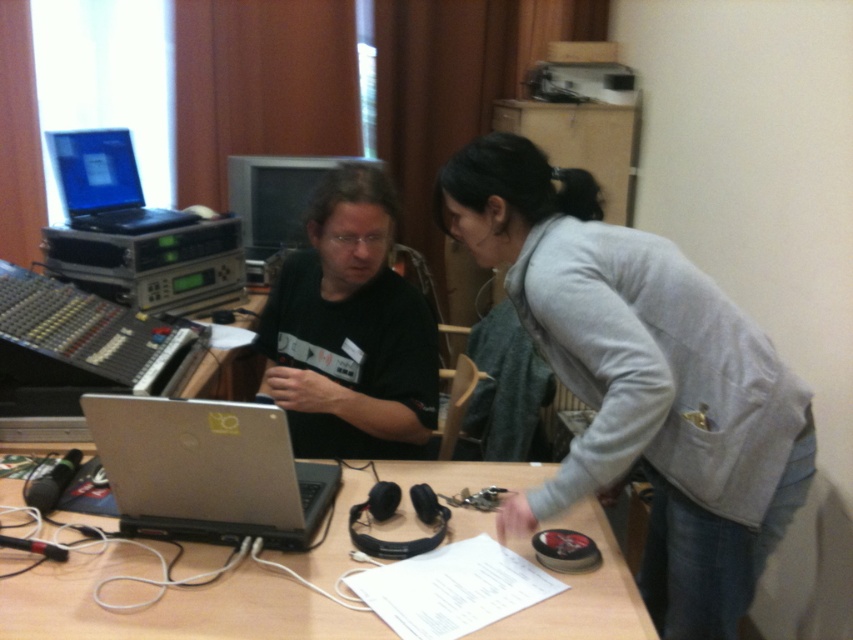
Question: Which is farther from the black matte shirt at center?

Choices:
 (A) matte black laptop at upper left
 (B) gray fabric jacket at center

Answer: (A)

Question: Is wooden table at center bigger than matte black laptop at upper left?

Choices:
 (A) no
 (B) yes

Answer: (B)

Question: Which object is the closest to the silver metallic laptop at center?

Choices:
 (A) black matte shirt at center
 (B) wooden table at center
 (C) gray fabric jacket at center

Answer: (B)

Question: In this image, where is gray fabric jacket at center located relative to wooden table at center?

Choices:
 (A) above
 (B) below

Answer: (A)

Question: Which of the following is the closest to the observer?

Choices:
 (A) wooden table at center
 (B) gray fabric jacket at center

Answer: (A)

Question: Is gray fabric jacket at center positioned before black matte shirt at center?

Choices:
 (A) no
 (B) yes

Answer: (B)